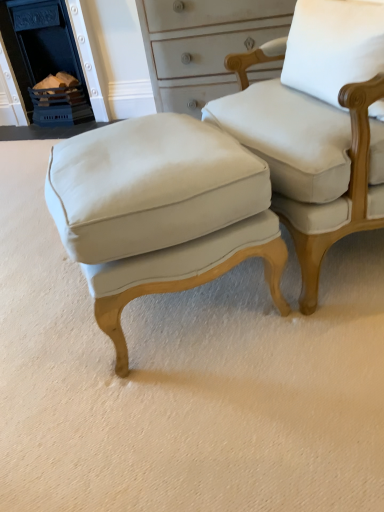
Question: Should I look upward or downward to see matte white stool at center?

Choices:
 (A) down
 (B) up

Answer: (B)

Question: Can you confirm if matte white fabric chair at center is shorter than blue painted brick fireplace at upper left?

Choices:
 (A) yes
 (B) no

Answer: (A)

Question: From a real-world perspective, is matte white fabric chair at center located higher than blue painted brick fireplace at upper left?

Choices:
 (A) yes
 (B) no

Answer: (B)

Question: Can you confirm if matte white fabric chair at center is wider than blue painted brick fireplace at upper left?

Choices:
 (A) yes
 (B) no

Answer: (A)

Question: Does matte white fabric chair at center have a lesser width compared to blue painted brick fireplace at upper left?

Choices:
 (A) no
 (B) yes

Answer: (A)

Question: From the image's perspective, is matte white fabric chair at center below blue painted brick fireplace at upper left?

Choices:
 (A) yes
 (B) no

Answer: (A)

Question: From the image's perspective, is matte white fabric chair at center located above blue painted brick fireplace at upper left?

Choices:
 (A) no
 (B) yes

Answer: (A)

Question: Could you tell me if matte white stool at center is turned towards matte white fabric chair at center?

Choices:
 (A) yes
 (B) no

Answer: (A)

Question: Considering the relative positions of matte white stool at center and matte white fabric chair at center in the image provided, is matte white stool at center to the right of matte white fabric chair at center from the viewer's perspective?

Choices:
 (A) yes
 (B) no

Answer: (B)

Question: Is matte white stool at center wider than matte white fabric chair at center?

Choices:
 (A) no
 (B) yes

Answer: (A)

Question: Is matte white stool at center turned away from matte white fabric chair at center?

Choices:
 (A) no
 (B) yes

Answer: (A)

Question: Considering the relative sizes of matte white stool at center and matte white fabric chair at center in the image provided, is matte white stool at center taller than matte white fabric chair at center?

Choices:
 (A) yes
 (B) no

Answer: (B)

Question: Is matte white stool at center shorter than matte white fabric chair at center?

Choices:
 (A) yes
 (B) no

Answer: (A)

Question: Does blue painted brick fireplace at upper left have a greater width compared to white fabric pillow at upper right?

Choices:
 (A) no
 (B) yes

Answer: (B)